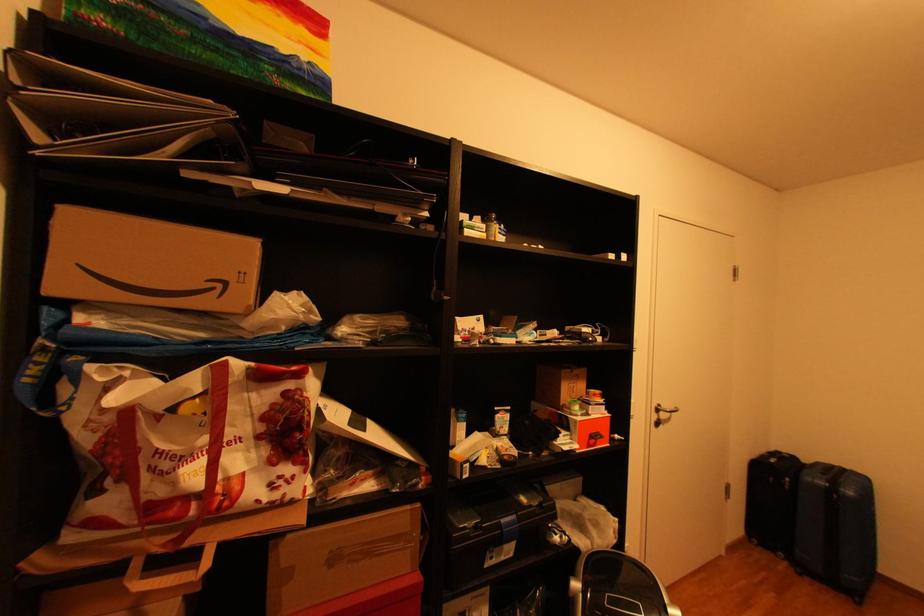
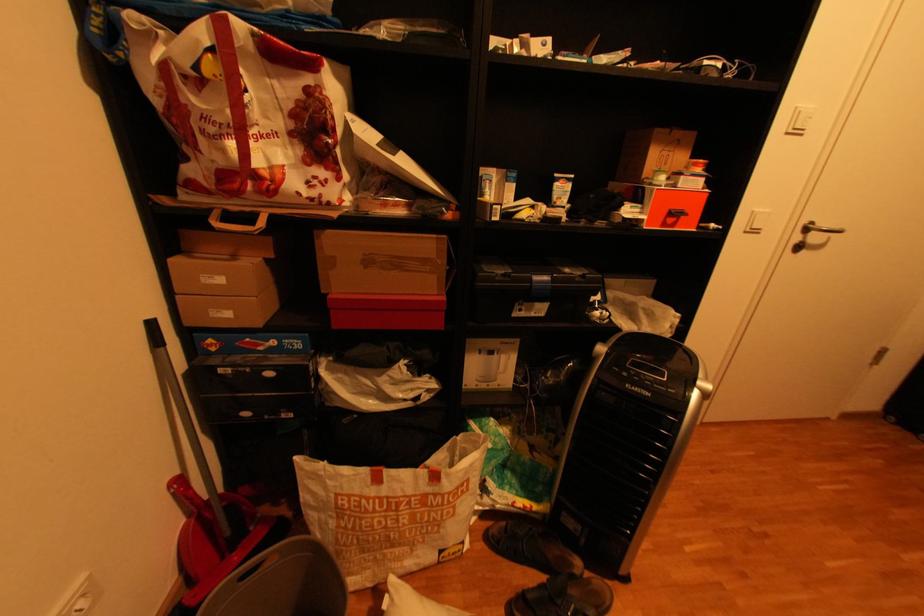
Where in the second image is the point corresponding to (x=604, y=395) from the first image?

(704, 166)